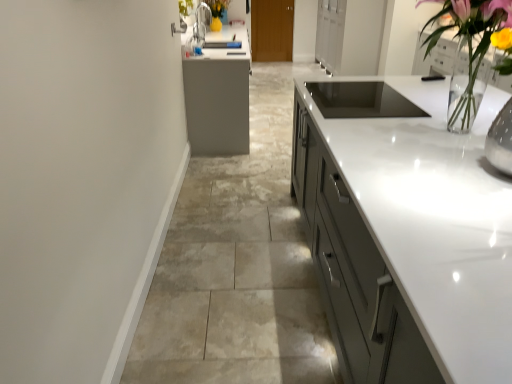
Question: From a real-world perspective, is clear glass vase at upper right below matte gray cabinetry at center, acting as the first cabinetry starting from the front?

Choices:
 (A) yes
 (B) no

Answer: (B)

Question: Does clear glass vase at upper right come behind matte gray cabinetry at center, marked as the second cabinetry in a back-to-front arrangement?

Choices:
 (A) no
 (B) yes

Answer: (A)

Question: Considering the relative sizes of clear glass vase at upper right and matte gray cabinetry at center, which appears as the 2th cabinetry when viewed from the top, in the image provided, is clear glass vase at upper right bigger than matte gray cabinetry at center, which appears as the 2th cabinetry when viewed from the top,?

Choices:
 (A) no
 (B) yes

Answer: (A)

Question: Can you confirm if clear glass vase at upper right is thinner than matte gray cabinetry at center, acting as the first cabinetry starting from the front?

Choices:
 (A) yes
 (B) no

Answer: (A)

Question: Is clear glass vase at upper right outside matte gray cabinetry at center, acting as the first cabinetry starting from the front?

Choices:
 (A) yes
 (B) no

Answer: (A)

Question: From their relative heights in the image, would you say clear glass vase at upper right is taller or shorter than matte gray cabinetry at center, the 1th cabinetry from the bottom?

Choices:
 (A) tall
 (B) short

Answer: (A)

Question: Is clear glass vase at upper right wider or thinner than matte gray cabinetry at center, the 1th cabinetry from the bottom?

Choices:
 (A) wide
 (B) thin

Answer: (B)

Question: Would you say clear glass vase at upper right is inside or outside matte gray cabinetry at center, acting as the first cabinetry starting from the front?

Choices:
 (A) outside
 (B) inside

Answer: (A)

Question: From a real-world perspective, relative to matte gray cabinetry at center, which appears as the 2th cabinetry when viewed from the top, is clear glass vase at upper right vertically above or below?

Choices:
 (A) below
 (B) above

Answer: (B)

Question: From a real-world perspective, is matte gray cabinetry at center, which appears as the 2th cabinetry when viewed from the top, physically located above or below brown wood door at center, positioned as the first cabinetry in top-to-bottom order?

Choices:
 (A) below
 (B) above

Answer: (A)

Question: In terms of width, does matte gray cabinetry at center, the 1th cabinetry from the bottom, look wider or thinner when compared to brown wood door at center, the 1th cabinetry positioned from the back?

Choices:
 (A) thin
 (B) wide

Answer: (B)

Question: From the image's perspective, is matte gray cabinetry at center, the 1th cabinetry from the bottom, positioned above or below brown wood door at center, which appears as the 2th cabinetry when viewed from the front?

Choices:
 (A) below
 (B) above

Answer: (A)

Question: Considering their positions, is matte gray cabinetry at center, acting as the first cabinetry starting from the front, located in front of or behind brown wood door at center, positioned as the first cabinetry in top-to-bottom order?

Choices:
 (A) front
 (B) behind

Answer: (A)

Question: Is clear glass vase at upper right in front of or behind brown wood door at center, which appears as the 2th cabinetry when viewed from the front, in the image?

Choices:
 (A) front
 (B) behind

Answer: (A)

Question: Considering the positions of clear glass vase at upper right and brown wood door at center, which is the 2th cabinetry in bottom-to-top order, in the image, is clear glass vase at upper right wider or thinner than brown wood door at center, which is the 2th cabinetry in bottom-to-top order,?

Choices:
 (A) thin
 (B) wide

Answer: (B)